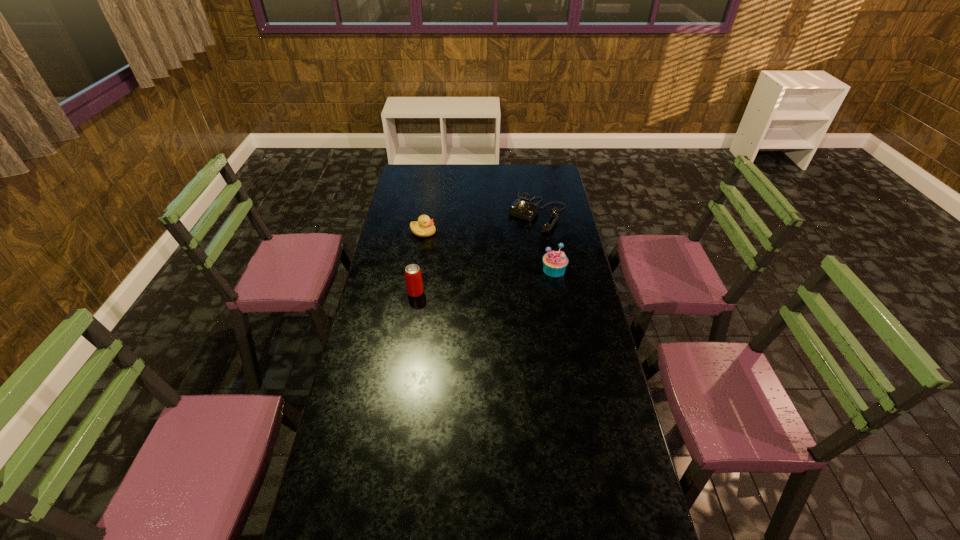
Locate an element on the screen. This screenshot has height=540, width=960. blank area located on the dial of the telephone is located at coordinates (513, 250).

Locate an element on the screen. The image size is (960, 540). free space located 0.080m on the dial of the telephone is located at coordinates (519, 241).

Image resolution: width=960 pixels, height=540 pixels. In order to click on beer can located in the left edge section of the desktop in this screenshot , I will do `click(413, 277)`.

This screenshot has width=960, height=540. Identify the location of duckling at the left edge. (424, 227).

Locate an element on the screen. The width and height of the screenshot is (960, 540). muffin at the right edge is located at coordinates [x=554, y=262].

The width and height of the screenshot is (960, 540). I want to click on telephone that is positioned at the right edge, so click(x=522, y=208).

The image size is (960, 540). Find the location of `vacant region at the far edge of the desktop`. vacant region at the far edge of the desktop is located at coordinates (510, 166).

Find the location of `free space at the left edge`. free space at the left edge is located at coordinates (404, 242).

Image resolution: width=960 pixels, height=540 pixels. In the image, there is a desktop. In order to click on free space at the right edge in this screenshot , I will do `click(571, 304)`.

In the image, there is a desktop. At what (x,y) coordinates should I click in order to perform the action: click on vacant space at the far right corner. Please return your answer as a coordinate pair (x, y). Looking at the image, I should click on (559, 177).